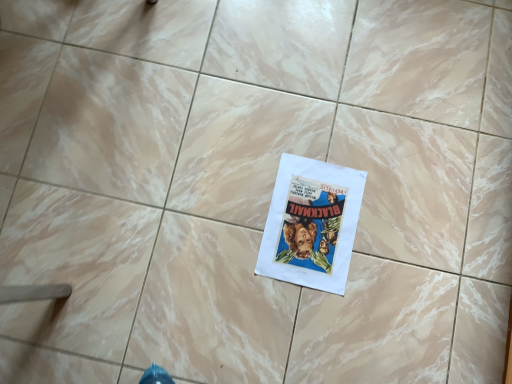
Locate an element on the screen. Image resolution: width=512 pixels, height=384 pixels. vacant region to the left of white paper poster at center is located at coordinates (221, 229).